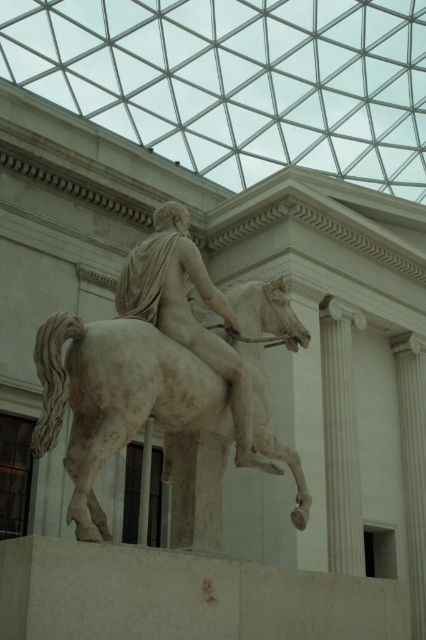
Question: Does white marble horse at center have a larger size compared to white marble statue at center?

Choices:
 (A) no
 (B) yes

Answer: (B)

Question: Estimate the real-world distances between objects in this image. Which object is farther from the white marble statue at center?

Choices:
 (A) white marble horse at center
 (B) white marble column at center

Answer: (B)

Question: Which of the following is the farthest from the observer?

Choices:
 (A) (230, 310)
 (B) (333, 387)

Answer: (B)

Question: Is white marble statue at center above white marble column at center?

Choices:
 (A) yes
 (B) no

Answer: (A)

Question: Is white marble statue at center above white marble column at center?

Choices:
 (A) no
 (B) yes

Answer: (B)

Question: Which is farther from the white marble column at center?

Choices:
 (A) white marble statue at center
 (B) white marble horse at center

Answer: (B)